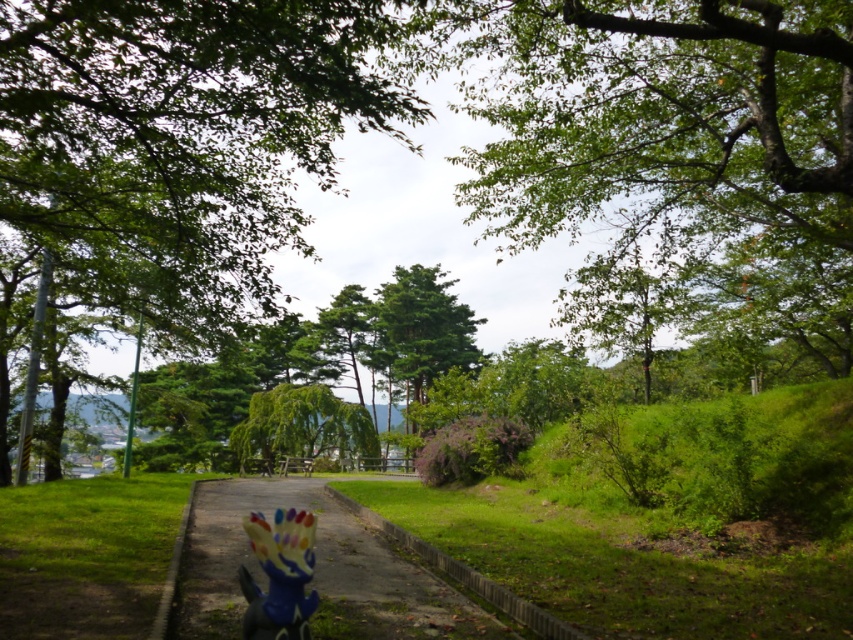
You are a gardener who wants to place a new flower pot on the dull concrete path at center. The flower pot is as wide as the plastic rainbow easter bunny at center. Will the flower pot fit on the path without overlapping the edges?

The dull concrete path at center is wider than the plastic rainbow easter bunny at center, so the flower pot, which is as wide as the bunny, will fit on the path without overlapping the edges.

You are a hiker walking along the paved path in the park and notice the green leafy tree at upper center and the green matte tree at center. Which tree is positioned more to the right side of the path?

The green leafy tree at upper center is positioned more to the right side of the path than the green matte tree at center.

You are standing at the point marked as point (314,572) in the park. What type of surface are you currently standing on?

You are standing on the dull concrete path at center located at point (314,572).